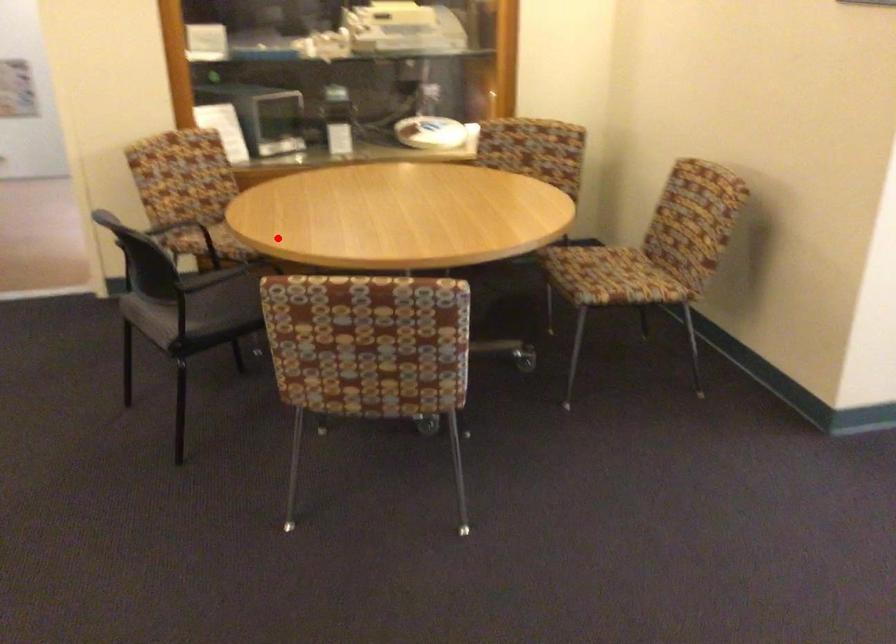
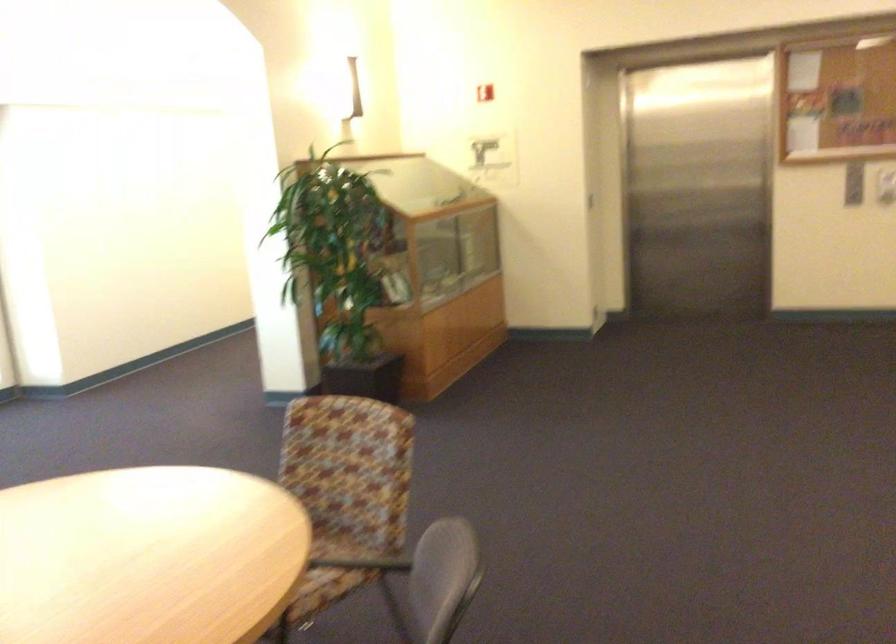
Find the pixel in the second image that matches the highlighted location in the first image.

(288, 535)